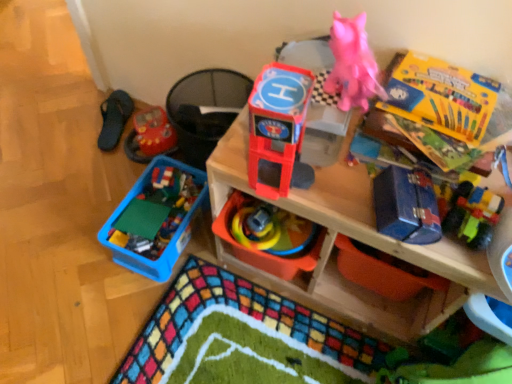
Question: Considering the relative sizes of yellow cardboard box at upper right, which appears as the third storage box when ordered from the bottom, and black fabric slipper at left in the image provided, is yellow cardboard box at upper right, which appears as the third storage box when ordered from the bottom, bigger than black fabric slipper at left?

Choices:
 (A) yes
 (B) no

Answer: (B)

Question: Is yellow cardboard box at upper right, arranged as the first storage box when viewed from the top, looking in the opposite direction of black fabric slipper at left?

Choices:
 (A) no
 (B) yes

Answer: (A)

Question: Is yellow cardboard box at upper right, which appears as the third storage box when ordered from the bottom, shorter than black fabric slipper at left?

Choices:
 (A) yes
 (B) no

Answer: (A)

Question: Could you tell me if yellow cardboard box at upper right, which appears as the third storage box when ordered from the bottom, is turned towards black fabric slipper at left?

Choices:
 (A) no
 (B) yes

Answer: (A)

Question: Does yellow cardboard box at upper right, which appears as the third storage box when ordered from the bottom, appear on the left side of black fabric slipper at left?

Choices:
 (A) no
 (B) yes

Answer: (A)

Question: Is blue metallic toolbox at right, marked as the second toy in a front-to-back arrangement, bigger or smaller than blue plastic container at lower left, the second toy positioned from the back?

Choices:
 (A) small
 (B) big

Answer: (A)

Question: Is blue metallic toolbox at right, marked as the second toy in a front-to-back arrangement, inside the boundaries of blue plastic container at lower left, the second toy positioned from the back, or outside?

Choices:
 (A) outside
 (B) inside

Answer: (A)

Question: From their relative heights in the image, would you say blue metallic toolbox at right, placed as the 4th toy when sorted from back to front, is taller or shorter than blue plastic container at lower left, the second toy positioned from the back?

Choices:
 (A) short
 (B) tall

Answer: (A)

Question: From a real-world perspective, is blue metallic toolbox at right, placed as the 4th toy when sorted from back to front, above or below blue plastic container at lower left, the second toy positioned from the back?

Choices:
 (A) below
 (B) above

Answer: (B)

Question: Which is correct: shiny plastic toy helicopter at center, the 5th toy in the back-to-front sequence, is inside blue metallic toolbox at upper right, positioned as the 3th storage box in top-to-bottom order, or outside of it?

Choices:
 (A) inside
 (B) outside

Answer: (B)

Question: Looking at their shapes, would you say shiny plastic toy helicopter at center, the 5th toy in the back-to-front sequence, is wider or thinner than blue metallic toolbox at upper right, positioned as the 3th storage box in top-to-bottom order?

Choices:
 (A) wide
 (B) thin

Answer: (B)

Question: From a real-world perspective, is shiny plastic toy helicopter at center, which ranks as the first toy in front-to-back order, above or below blue metallic toolbox at upper right, positioned as the 3th storage box in top-to-bottom order?

Choices:
 (A) below
 (B) above

Answer: (B)

Question: Is point (275, 137) closer or farther from the camera than point (435, 296)?

Choices:
 (A) farther
 (B) closer

Answer: (B)

Question: From their relative heights in the image, would you say shiny plastic toy helicopter at center, which ranks as the first toy in front-to-back order, is taller or shorter than blue plastic container at lower left, the second toy positioned from the back?

Choices:
 (A) short
 (B) tall

Answer: (B)

Question: From the image's perspective, is shiny plastic toy helicopter at center, which ranks as the first toy in front-to-back order, located above or below blue plastic container at lower left, the second toy positioned from the back?

Choices:
 (A) above
 (B) below

Answer: (A)